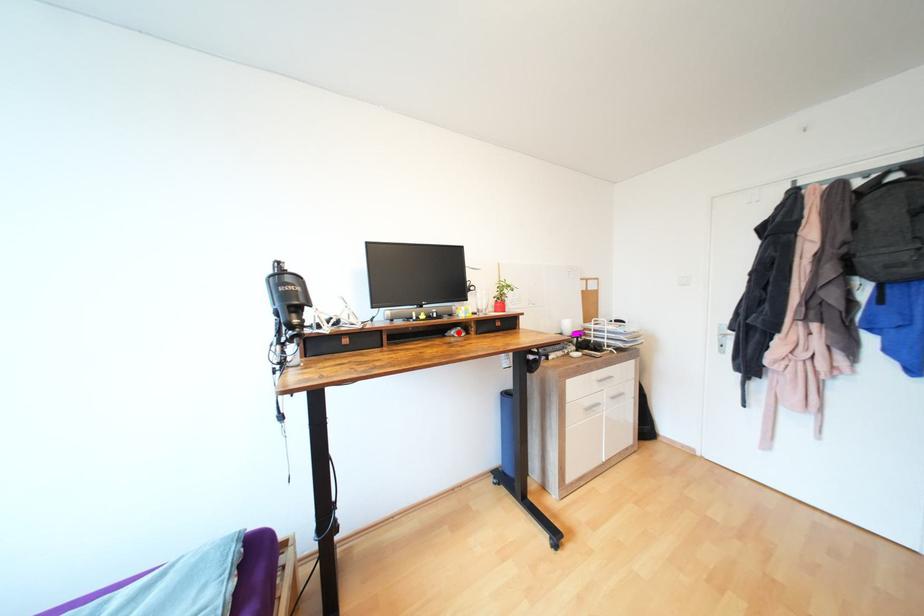
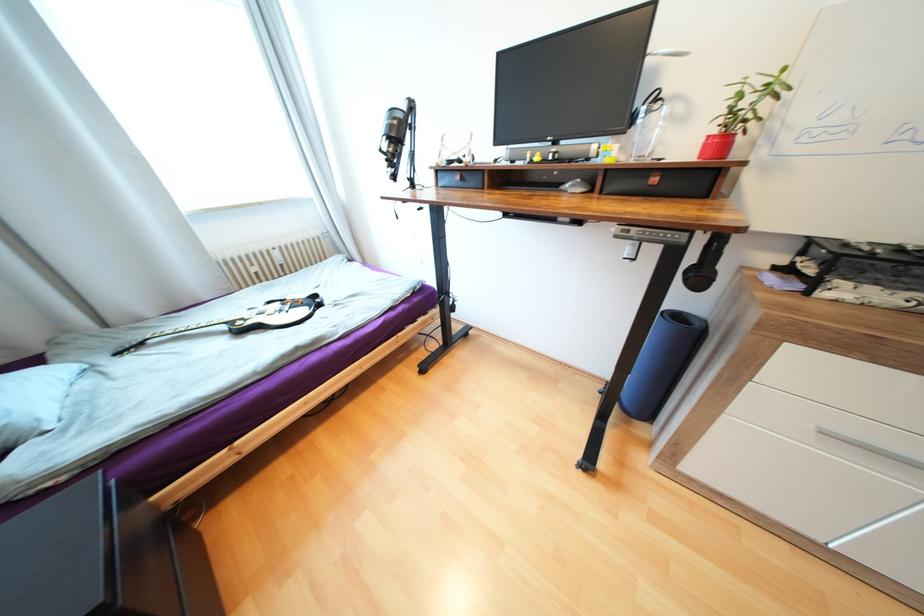
The point at the highlighted location is marked in the first image. Where is the corresponding point in the second image?

(574, 185)